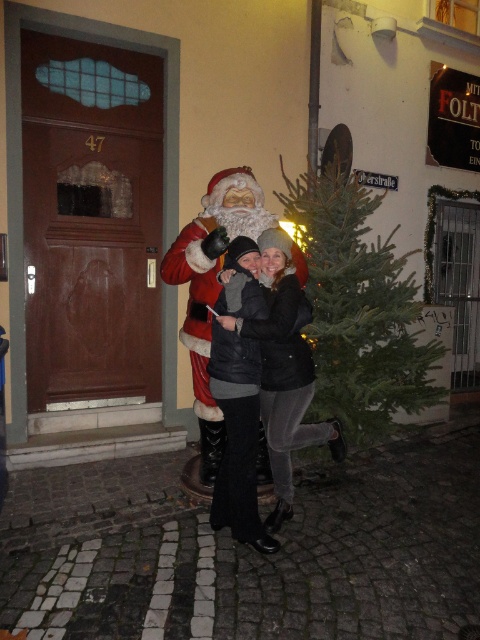
Between green matte christmas tree at center and black leather jacket at center, which one has less height?

black leather jacket at center is shorter.

Is point (327, 392) closer to camera compared to point (269, 326)?

No, (327, 392) is behind (269, 326).

The height and width of the screenshot is (640, 480). What are the coordinates of `green matte christmas tree at center` in the screenshot? It's located at (358, 307).

Does black leather jacket at center appear on the left side of red plush santa at center?

Incorrect, black leather jacket at center is not on the left side of red plush santa at center.

Looking at this image, is black leather jacket at center wider than red plush santa at center?

Correct, the width of black leather jacket at center exceeds that of red plush santa at center.

Identify the location of black leather jacket at center. The width and height of the screenshot is (480, 640). click(286, 371).

Where is `black leather jacket at center`? The height and width of the screenshot is (640, 480). black leather jacket at center is located at coordinates (286, 371).

The width and height of the screenshot is (480, 640). What do you see at coordinates (358, 307) in the screenshot?
I see `green matte christmas tree at center` at bounding box center [358, 307].

From the picture: Can you confirm if green matte christmas tree at center is positioned to the right of red plush santa at center?

Indeed, green matte christmas tree at center is positioned on the right side of red plush santa at center.

What do you see at coordinates (358, 307) in the screenshot? This screenshot has width=480, height=640. I see `green matte christmas tree at center` at bounding box center [358, 307].

Identify the location of green matte christmas tree at center. The height and width of the screenshot is (640, 480). (358, 307).